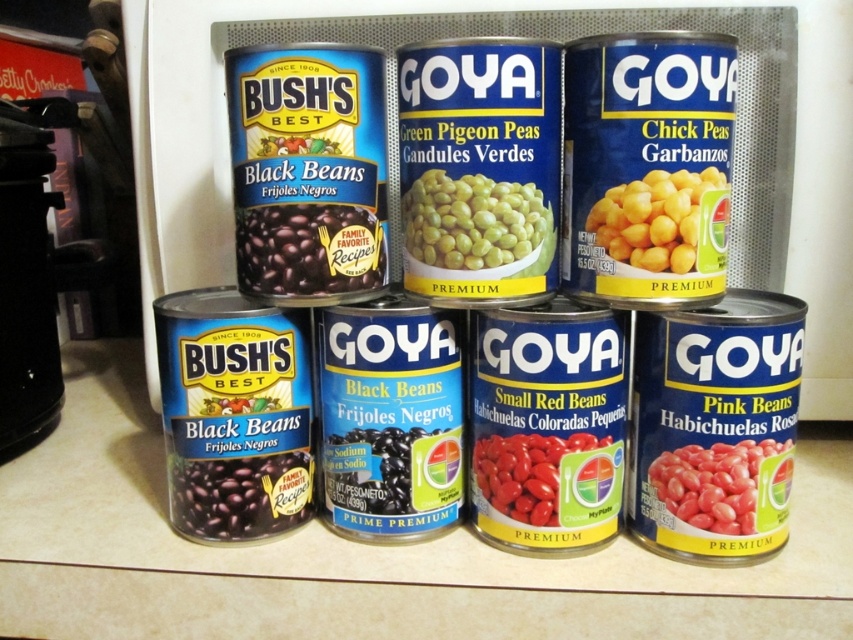
You are organizing a pantry and see the yellow matte chick peas at center right and the black matte beans at center. Which can is smaller in size?

The yellow matte chick peas at center right is smaller than the black matte beans at center.

You are organizing canned goods on a kitchen countertop and see the green matte peas at center and the matte black beans at lower left. Which canned good is positioned higher up?

The green matte peas at center is positioned higher up since it is above the matte black beans at lower left.